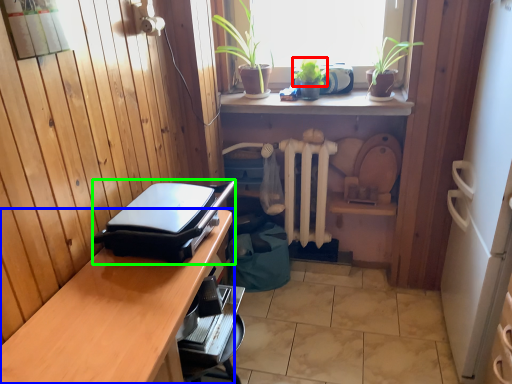
Question: Estimate the real-world distances between objects in this image. Which object is closer to plant (highlighted by a red box), desk (highlighted by a blue box) or appliance (highlighted by a green box)?

Choices:
 (A) desk
 (B) appliance

Answer: (B)